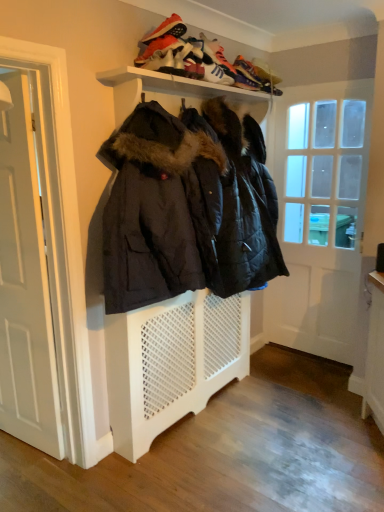
Question: From the image's perspective, is white wooden door at left, arranged as the second door when viewed from the back, below white glossy door at right, arranged as the second door when viewed from the front?

Choices:
 (A) yes
 (B) no

Answer: (A)

Question: Considering the relative sizes of white wooden door at left, which is the 2th door in right-to-left order, and white glossy door at right, placed as the second door when sorted from left to right, in the image provided, is white wooden door at left, which is the 2th door in right-to-left order, taller than white glossy door at right, placed as the second door when sorted from left to right,?

Choices:
 (A) yes
 (B) no

Answer: (B)

Question: From the image's perspective, is white wooden door at left, which is the 2th door in right-to-left order, over white glossy door at right, arranged as the second door when viewed from the front?

Choices:
 (A) no
 (B) yes

Answer: (A)

Question: Considering the relative positions of white wooden door at left, the first door in the front-to-back sequence, and white glossy door at right, the first door from the back, in the image provided, is white wooden door at left, the first door in the front-to-back sequence, to the right of white glossy door at right, the first door from the back, from the viewer's perspective?

Choices:
 (A) yes
 (B) no

Answer: (B)

Question: Is white wooden door at left, acting as the first door starting from the left, facing towards white glossy door at right, the 1th door viewed from the right?

Choices:
 (A) yes
 (B) no

Answer: (B)

Question: Which is correct: white wooden door at left, acting as the first door starting from the left, is inside leather suede sneaker at upper center, which ranks as the 3th shoe in back-to-front order, or outside of it?

Choices:
 (A) outside
 (B) inside

Answer: (A)

Question: From the image's perspective, is white wooden door at left, arranged as the second door when viewed from the back, located above or below leather suede sneaker at upper center, which ranks as the second shoe in front-to-back order?

Choices:
 (A) below
 (B) above

Answer: (A)

Question: Does point (6, 79) appear closer or farther from the camera than point (173, 66)?

Choices:
 (A) closer
 (B) farther

Answer: (A)

Question: From their relative heights in the image, would you say white wooden door at left, the first door in the front-to-back sequence, is taller or shorter than leather suede sneaker at upper center, which ranks as the 3th shoe in back-to-front order?

Choices:
 (A) short
 (B) tall

Answer: (B)

Question: Is leather suede sneaker at upper center, which ranks as the 3th shoe in back-to-front order, to the left or to the right of white glossy door at right, the 1th door viewed from the right, in the image?

Choices:
 (A) right
 (B) left

Answer: (B)

Question: In terms of height, does leather suede sneaker at upper center, which ranks as the second shoe in front-to-back order, look taller or shorter compared to white glossy door at right, placed as the second door when sorted from left to right?

Choices:
 (A) short
 (B) tall

Answer: (A)

Question: Considering the positions of leather suede sneaker at upper center, which ranks as the second shoe in front-to-back order, and white glossy door at right, arranged as the second door when viewed from the front, in the image, is leather suede sneaker at upper center, which ranks as the second shoe in front-to-back order, wider or thinner than white glossy door at right, arranged as the second door when viewed from the front,?

Choices:
 (A) thin
 (B) wide

Answer: (B)

Question: From a real-world perspective, relative to white glossy door at right, the first door from the back, is leather suede sneaker at upper center, which ranks as the second shoe in front-to-back order, vertically above or below?

Choices:
 (A) above
 (B) below

Answer: (A)

Question: Is point (172, 70) positioned closer to the camera than point (155, 75)?

Choices:
 (A) closer
 (B) farther

Answer: (B)

Question: Looking at their shapes, would you say white suede sneaker at upper center, the 4th shoe when ordered from back to front, is wider or thinner than white matte shelf at upper center?

Choices:
 (A) wide
 (B) thin

Answer: (B)